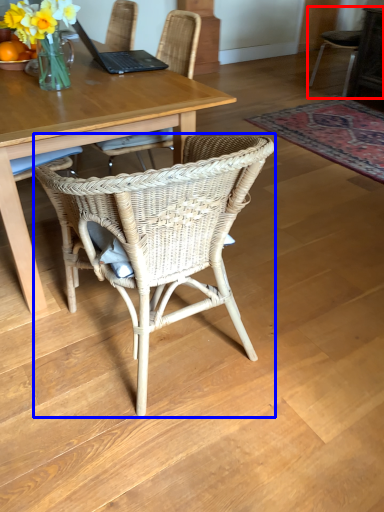
Question: Among these objects, which one is farthest to the camera, chair (highlighted by a red box) or chair (highlighted by a blue box)?

Choices:
 (A) chair
 (B) chair

Answer: (A)